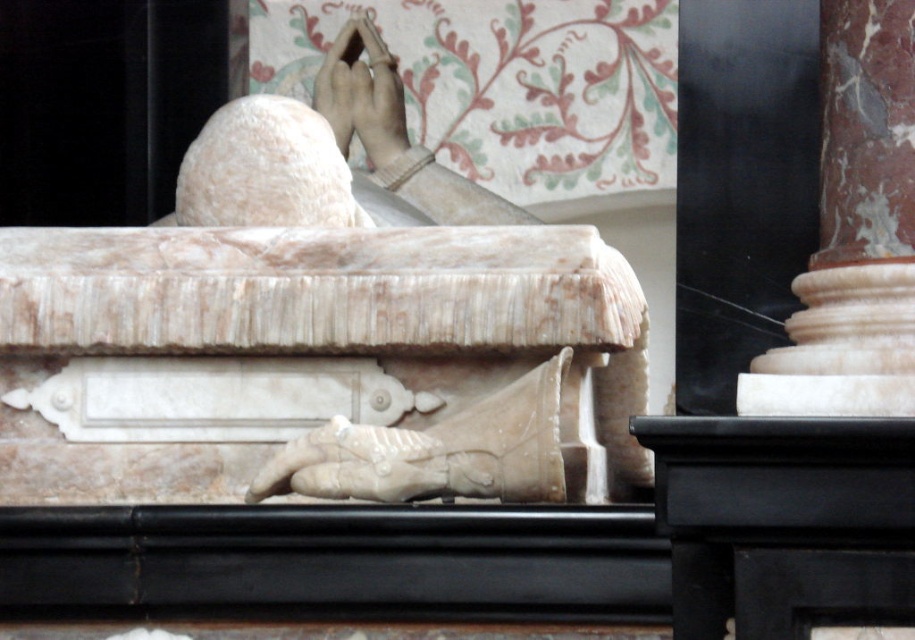
From the picture: Can you confirm if marble column at right is smaller than matte stone hand at upper center?

Correct, marble column at right occupies less space than matte stone hand at upper center.

Is marble column at right positioned in front of matte stone hand at upper center?

Yes.

Identify the location of marble column at right. (854, 232).

What do you see at coordinates (329, 326) in the screenshot? This screenshot has height=640, width=915. I see `white marble statue at center` at bounding box center [329, 326].

Can you confirm if white marble statue at center is taller than marble column at right?

Yes.

Is point (116, 336) farther from camera compared to point (849, 340)?

Yes, point (116, 336) is farther from viewer.

Locate an element on the screen. white marble statue at center is located at coordinates (329, 326).

Who is taller, white marble statue at center or matte stone hand at upper center?

Standing taller between the two is matte stone hand at upper center.

Is white marble statue at center shorter than matte stone hand at upper center?

Indeed, white marble statue at center has a lesser height compared to matte stone hand at upper center.

In order to click on white marble statue at center in this screenshot , I will do `click(329, 326)`.